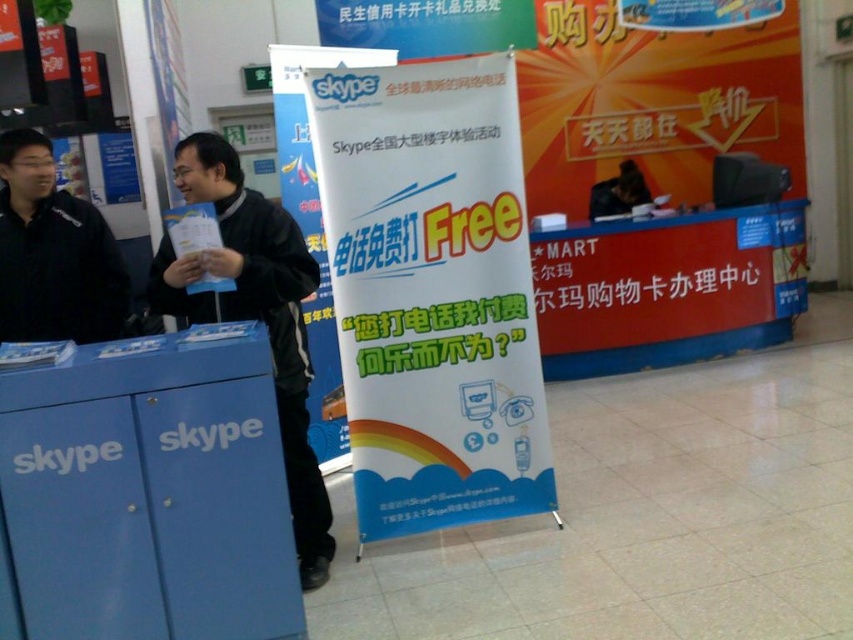
Who is more distant from viewer, (x=186, y=451) or (x=9, y=177)?

Point (x=9, y=177)

The height and width of the screenshot is (640, 853). What do you see at coordinates (146, 493) in the screenshot?
I see `blue matte skype cabinet at left` at bounding box center [146, 493].

This screenshot has width=853, height=640. I want to click on blue matte skype cabinet at left, so click(x=146, y=493).

Looking at this image, which of these two, white paper sign at center or black matte jacket at center, stands shorter?

Standing shorter between the two is black matte jacket at center.

Who is taller, white paper sign at center or black matte jacket at center?

white paper sign at center

Describe the element at coordinates (432, 292) in the screenshot. I see `white paper sign at center` at that location.

This screenshot has width=853, height=640. I want to click on white paper sign at center, so click(432, 292).

Does white paper sign at center appear under red plastic sign at center?

Correct, white paper sign at center is located below red plastic sign at center.

Which is behind, point (393, 141) or point (598, 376)?

The point (598, 376) is more distant.

Identify the location of white paper sign at center. (432, 292).